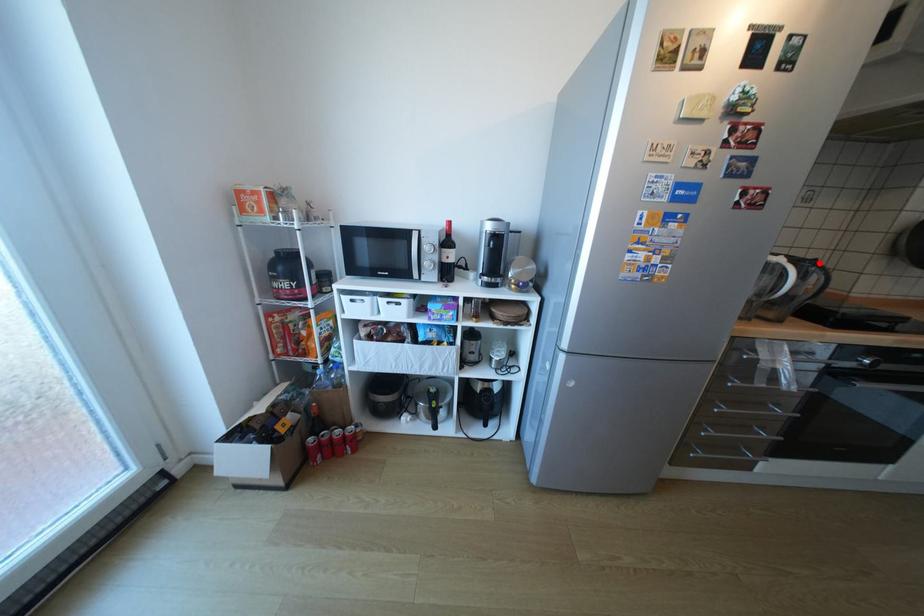
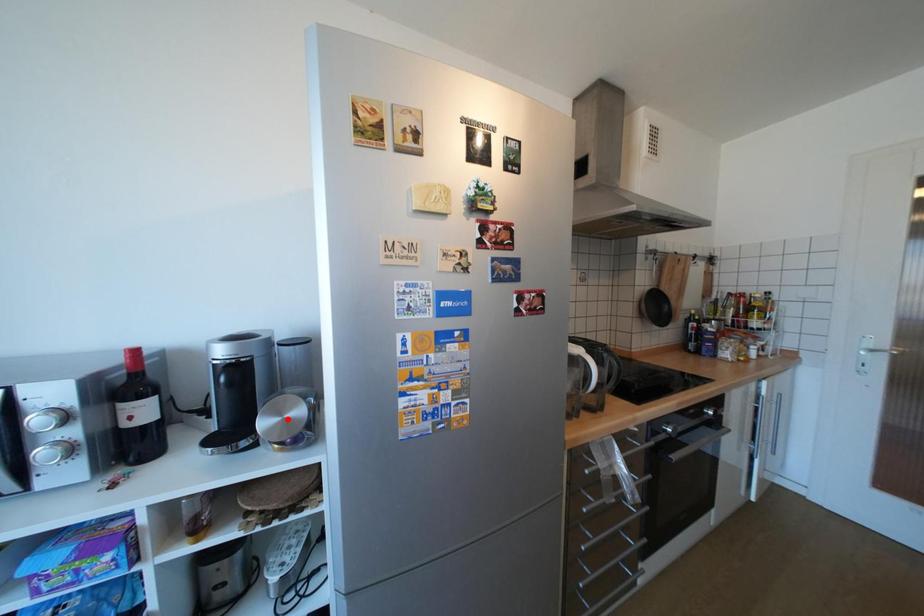
I am providing you with two images of the same scene from different viewpoints. A red point is marked on the first image and another point is marked on the second image. Do the highlighted points in image1 and image2 indicate the same real-world spot?

No